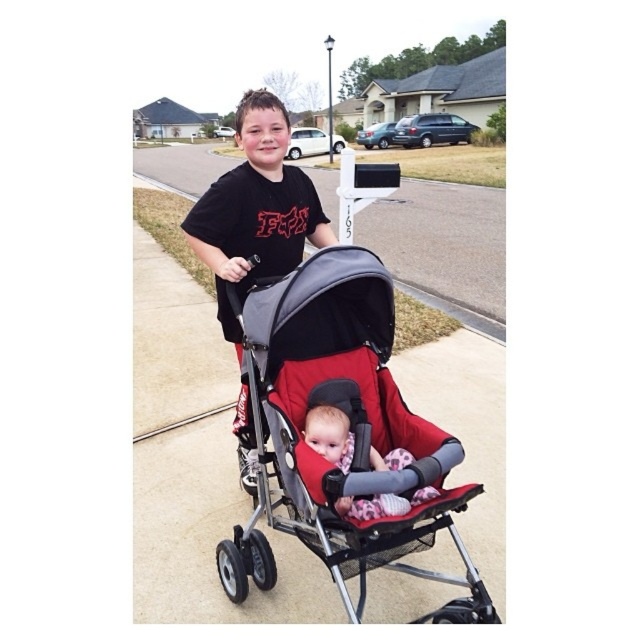
You are a delivery person trying to deliver a package to the baby in the stroller. The red fabric stroller at center and the gray fabric stroller at center are in your way. Which stroller should you move first to access the baby?

The red fabric stroller at center is positioned under the gray fabric stroller at center, so you should move the gray fabric stroller at center first to access the baby.

You are a photographer trying to capture a closeup of the baby in the stroller. You notice two points in the image labeled as point 1 and point 2. Point 1 is at coordinates (461, 554) and point 2 is at coordinates (360, 234). Which point should you focus on to get the best closeup of the baby?

Point 1 at coordinates (461, 554) is closer to the camera than point 2 at coordinates (360, 234). Therefore, focusing on point 1 would provide a better closeup of the baby since it is nearer to the camera.

You are a delivery drone that needs to land on a flat area near the red fabric stroller at center. Based on the scene description, can you confirm if there is enough space to land safely?

The red fabric stroller at center is positioned at coordinates point [349,429]. Since the scene describes a suburban residential street with a sidewalk, there should be sufficient flat area nearby for the drone to land safely.